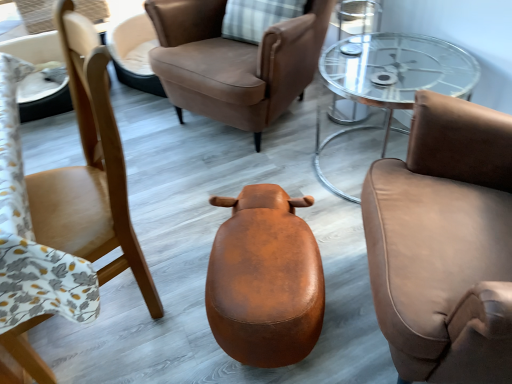
Question: Are matte brown chair at left, which is the 1th chair from left to right, and clear glass coffee table at center far apart?

Choices:
 (A) no
 (B) yes

Answer: (B)

Question: Can you confirm if matte brown chair at left, which is the 1th chair from left to right, is taller than clear glass coffee table at center?

Choices:
 (A) yes
 (B) no

Answer: (A)

Question: From a real-world perspective, is matte brown chair at left, which is the 3th chair in right-to-left order, beneath clear glass coffee table at center?

Choices:
 (A) yes
 (B) no

Answer: (B)

Question: Is matte brown chair at left, which is the 1th chair from left to right, further to the viewer compared to clear glass coffee table at center?

Choices:
 (A) no
 (B) yes

Answer: (A)

Question: Could clear glass coffee table at center be considered to be inside matte brown chair at left, which is the 1th chair from left to right?

Choices:
 (A) yes
 (B) no

Answer: (B)

Question: Is matte brown chair at left, which is the 3th chair in right-to-left order, outside clear glass coffee table at center?

Choices:
 (A) no
 (B) yes

Answer: (B)

Question: Does brown leather chair at right, the third chair when ordered from left to right, have a smaller size compared to brown leather chair at center, the second chair viewed from the left?

Choices:
 (A) no
 (B) yes

Answer: (B)

Question: Is brown leather chair at right, the third chair when ordered from left to right, located outside brown leather chair at center, the second chair viewed from the left?

Choices:
 (A) no
 (B) yes

Answer: (B)

Question: From a real-world perspective, is brown leather chair at right, the third chair when ordered from left to right, on brown leather chair at center, which is the 2th chair from right to left?

Choices:
 (A) no
 (B) yes

Answer: (B)

Question: Can you confirm if brown leather chair at right, the third chair when ordered from left to right, is positioned to the left of brown leather chair at center, the second chair viewed from the left?

Choices:
 (A) yes
 (B) no

Answer: (B)

Question: From the image's perspective, is brown leather chair at right, which is the 1th chair from right to left, below brown leather chair at center, the second chair viewed from the left?

Choices:
 (A) no
 (B) yes

Answer: (B)

Question: Does brown leather chair at right, the third chair when ordered from left to right, have a lesser width compared to brown leather chair at center, which is the 2th chair from right to left?

Choices:
 (A) yes
 (B) no

Answer: (A)

Question: From the image's perspective, is brown leather chair at right, the third chair when ordered from left to right, on top of brown leather stool at center?

Choices:
 (A) no
 (B) yes

Answer: (B)